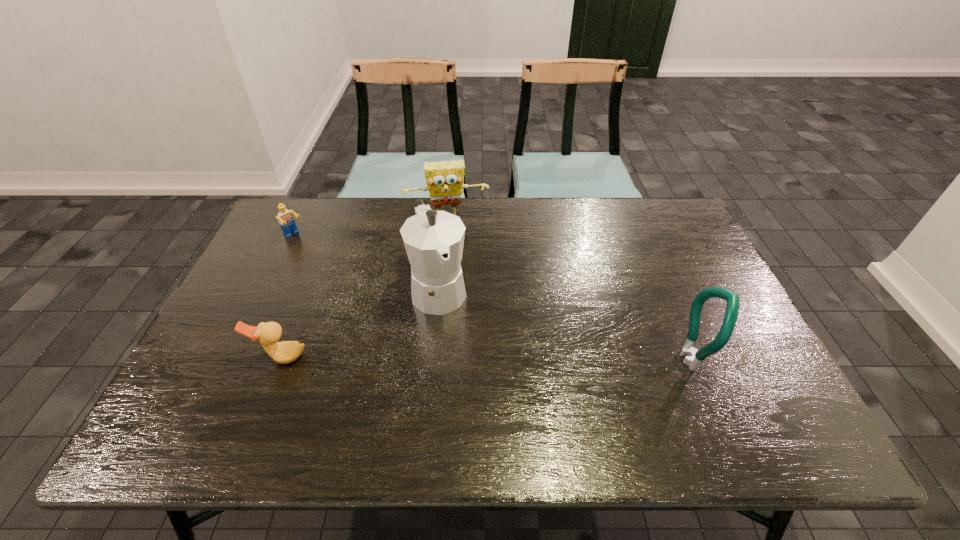
Image resolution: width=960 pixels, height=540 pixels. What are the coordinates of `free space on the desktop that is between the duck and the rightmost object and is positioned on the face of the farthest object` in the screenshot? It's located at (466, 358).

Locate an element on the screen. Image resolution: width=960 pixels, height=540 pixels. vacant spot on the desktop that is between the second object from left to right and the bottle opener and is positioned on the face of the Lego is located at coordinates (443, 358).

Locate an element on the screen. The image size is (960, 540). free space on the desktop that is between the duck and the rightmost object and is positioned at the spout of the third farthest object is located at coordinates (470, 358).